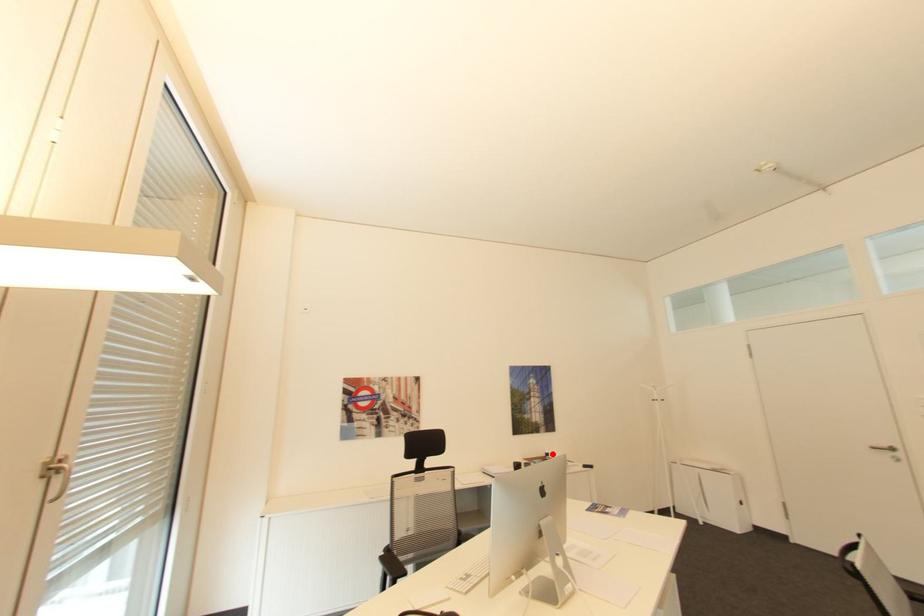
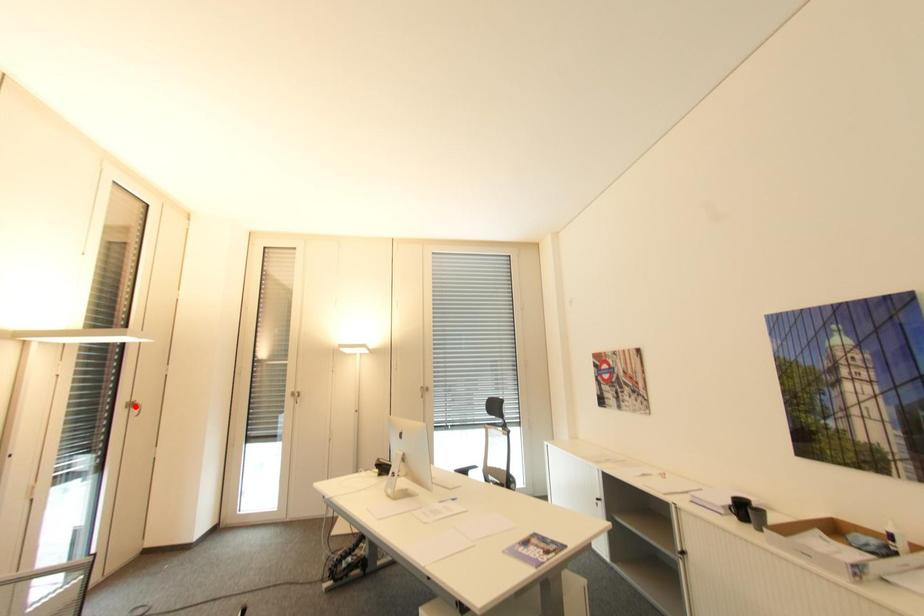
I am providing you with two images of the same scene from different viewpoints. A red point is marked on the first image and another point is marked on the second image. Is the red point in image1 aligned with the point shown in image2?

No